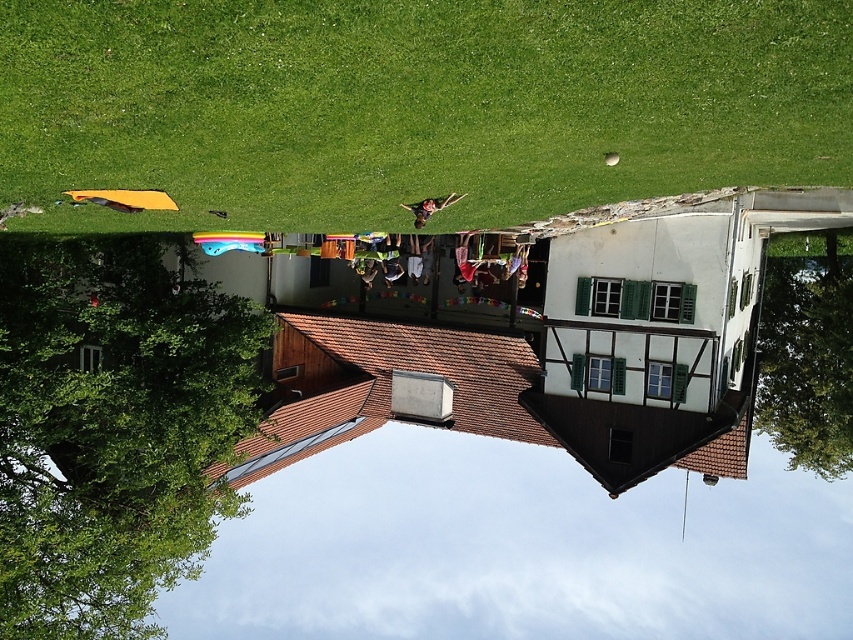
Is point (178, 438) less distant than point (817, 340)?

Yes, it is.

Locate an element on the screen. green leafy tree at left is located at coordinates (112, 428).

Find the location of `green leafy tree at left`. green leafy tree at left is located at coordinates (112, 428).

Identify the location of green grass at upper left. (415, 106).

Where is `green grass at upper left`? green grass at upper left is located at coordinates (415, 106).

Can you confirm if green grass at upper left is positioned below green leafy tree at left?

Incorrect, green grass at upper left is not positioned below green leafy tree at left.

Does green grass at upper left have a greater height compared to green leafy tree at left?

Incorrect, green grass at upper left's height is not larger of green leafy tree at left's.

Is point (581, 170) farther from camera compared to point (218, 509)?

No, it is not.

Locate an element on the screen. green grass at upper left is located at coordinates (415, 106).